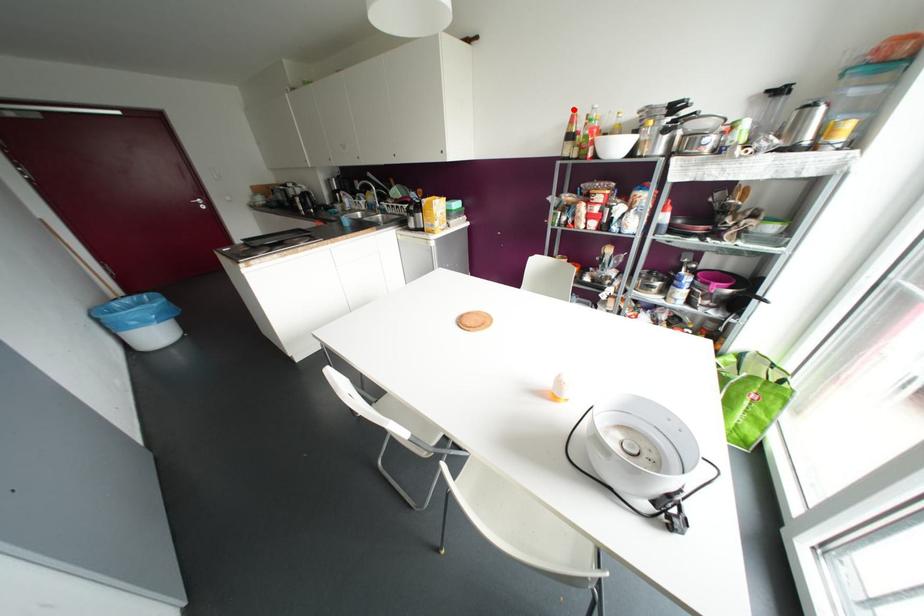
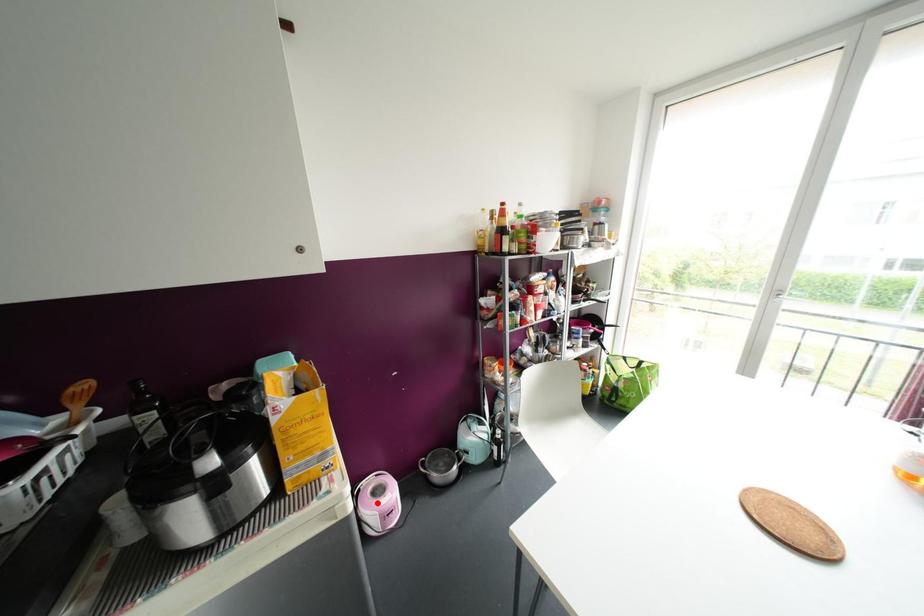
I am providing you with two images of the same scene from different viewpoints. A red point is marked on the first image and another point is marked on the second image. Is the red point in image1 aligned with the point shown in image2?

No